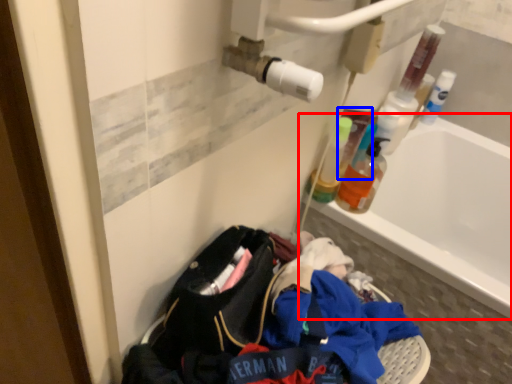
Question: Which object appears closest to the camera in this image, bathtub (highlighted by a red box) or mouthwash (highlighted by a blue box)?

Choices:
 (A) bathtub
 (B) mouthwash

Answer: (A)